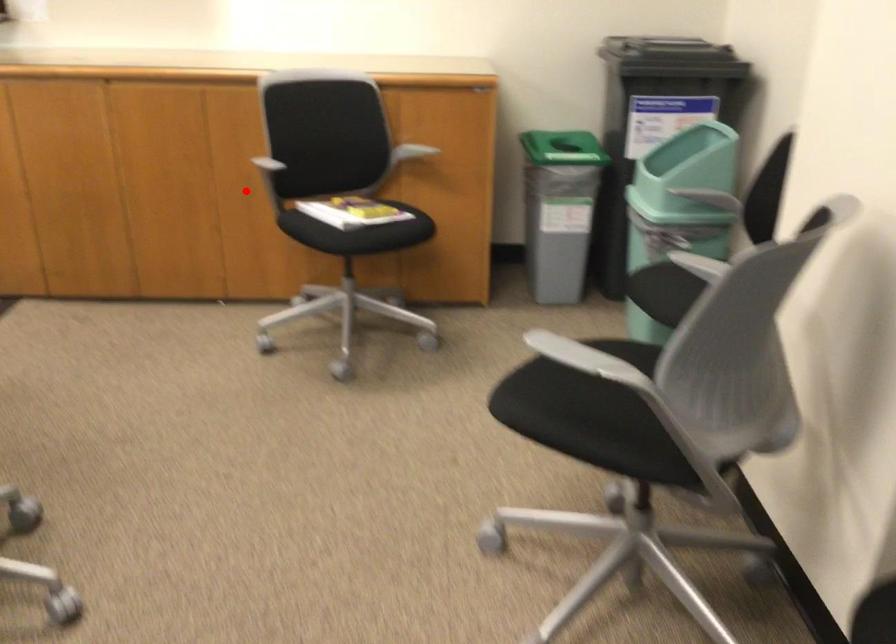
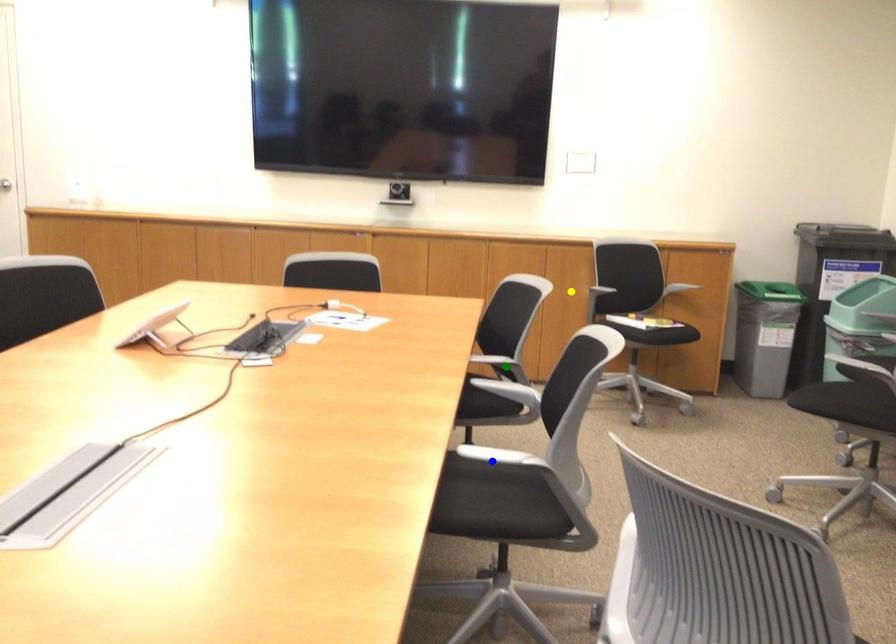
Question: I am providing you with two images of the same scene from different viewpoints. A red point is marked on the first image. You are given multiple points on the second image. Which point in image 2 is actually the same real-world point as the red point in image 1?

Choices:
 (A) yellow point
 (B) blue point
 (C) green point

Answer: (A)